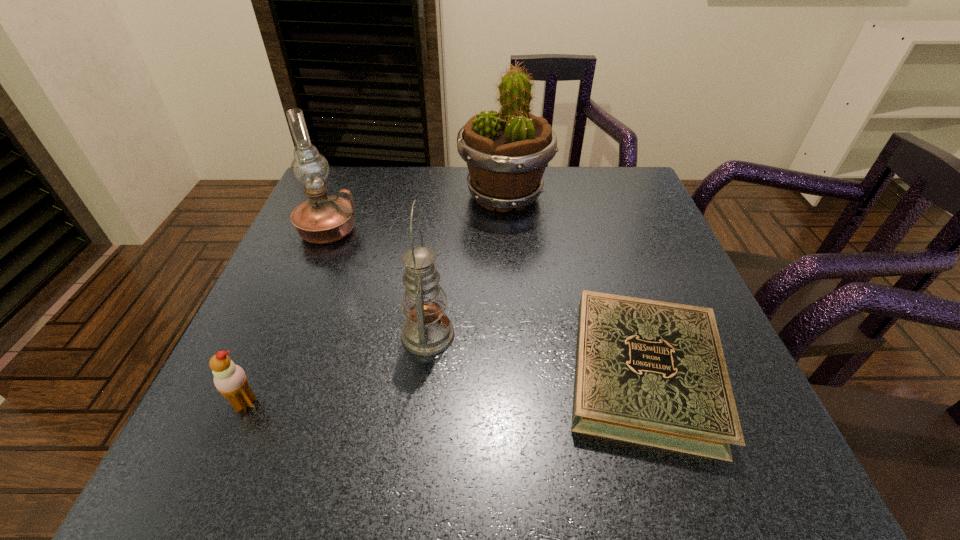
This screenshot has height=540, width=960. Identify the location of flowerpot that is at the far edge. (506, 152).

Find the location of a particular element. The image size is (960, 540). oil lamp that is at the far edge is located at coordinates [x=323, y=219].

Find the location of a particular element. object that is positioned at the near edge is located at coordinates (649, 372).

This screenshot has width=960, height=540. Identify the location of oil lamp at the left edge. (323, 219).

At what (x,y) coordinates should I click in order to perform the action: click on icecream located at the left edge. Please return your answer as a coordinate pair (x, y). Looking at the image, I should click on (230, 380).

Image resolution: width=960 pixels, height=540 pixels. I want to click on object located at the right edge, so pyautogui.click(x=649, y=372).

You are a GUI agent. You are given a task and a screenshot of the screen. Output one action in this format:
    pyautogui.click(x=<x>, y=<y>)
    Task: Click on the object present at the far left corner
    
    Given the screenshot: What is the action you would take?
    pyautogui.click(x=323, y=219)

Locate an element on the screen. This screenshot has height=540, width=960. object that is at the near right corner is located at coordinates (649, 372).

I want to click on vacant point at the far edge, so tap(402, 187).

Locate an element on the screen. Image resolution: width=960 pixels, height=540 pixels. free space at the left edge is located at coordinates coord(338,251).